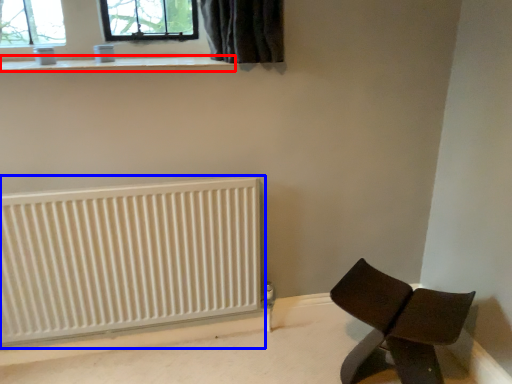
Question: Which object is further to the camera taking this photo, window sill (highlighted by a red box) or radiator (highlighted by a blue box)?

Choices:
 (A) window sill
 (B) radiator

Answer: (B)